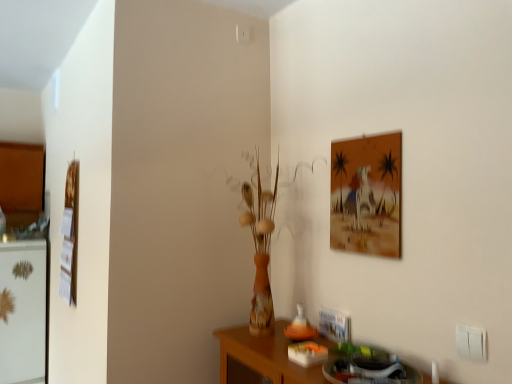
Question: In terms of width, does white plastic electric outlet at lower right look wider or thinner when compared to matte orange painting at upper right, which is the second picture frame from left to right?

Choices:
 (A) thin
 (B) wide

Answer: (A)

Question: Is white plastic electric outlet at lower right inside or outside of matte orange painting at upper right, which appears as the second picture frame when viewed from the back?

Choices:
 (A) inside
 (B) outside

Answer: (B)

Question: Which object is positioned closest to the white glossy fridge at left?

Choices:
 (A) matte orange painting at upper right, which appears as the second picture frame when viewed from the back
 (B) white plastic electric outlet at lower right
 (C) wooden picture frame at left, the 2th picture frame in the right-to-left sequence

Answer: (C)

Question: Estimate the real-world distances between objects in this image. Which object is farther from the wooden picture frame at left, marked as the first picture frame in a left-to-right arrangement?

Choices:
 (A) matte orange painting at upper right, the 1th picture frame when ordered from front to back
 (B) white glossy fridge at left
 (C) white plastic electric outlet at lower right

Answer: (C)